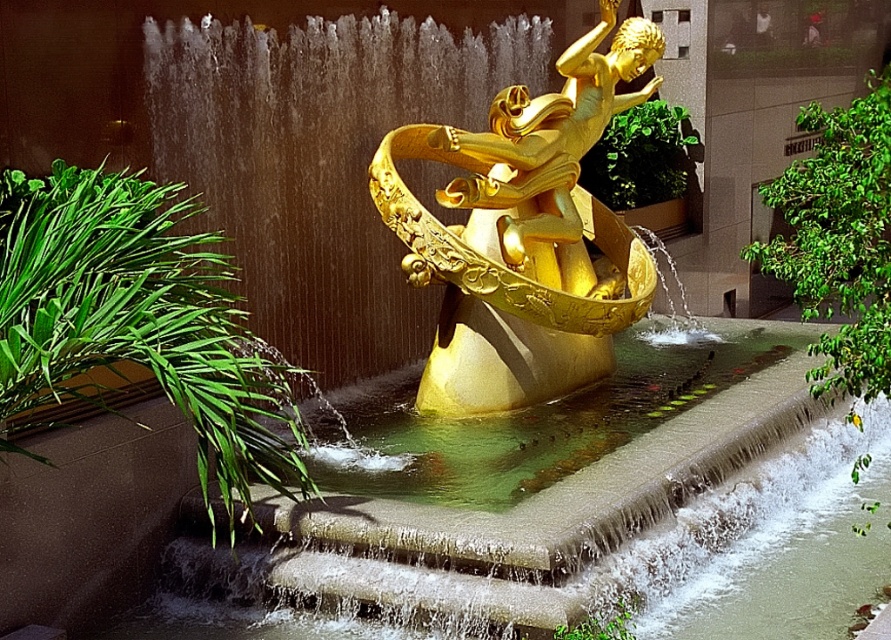
Can you confirm if clear water at fountain center is wider than green leafy plant at left?

Indeed, clear water at fountain center has a greater width compared to green leafy plant at left.

Who is higher up, clear water at fountain center or green leafy plant at left?

green leafy plant at left is higher up.

Measure the distance between point (x=172, y=548) and camera.

A distance of 9.75 meters exists between point (x=172, y=548) and camera.

The image size is (891, 640). What are the coordinates of `clear water at fountain center` in the screenshot? It's located at (563, 515).

Can you confirm if gold polished statue at center is wider than green leafy plant at upper center?

Indeed, gold polished statue at center has a greater width compared to green leafy plant at upper center.

Is gold polished statue at center taller than green leafy plant at upper center?

Indeed, gold polished statue at center has a greater height compared to green leafy plant at upper center.

Between point (538, 253) and point (603, 202), which one is positioned behind?

The point (603, 202) is behind.

Where is `gold polished statue at center`? gold polished statue at center is located at coordinates (524, 234).

Is green leafy plant at upper center to the left of green leafy plant at lower center from the viewer's perspective?

In fact, green leafy plant at upper center is to the right of green leafy plant at lower center.

Does green leafy plant at upper center appear on the right side of green leafy plant at lower center?

Yes, green leafy plant at upper center is to the right of green leafy plant at lower center.

Locate an element on the screen. The image size is (891, 640). green leafy plant at upper center is located at coordinates (639, 156).